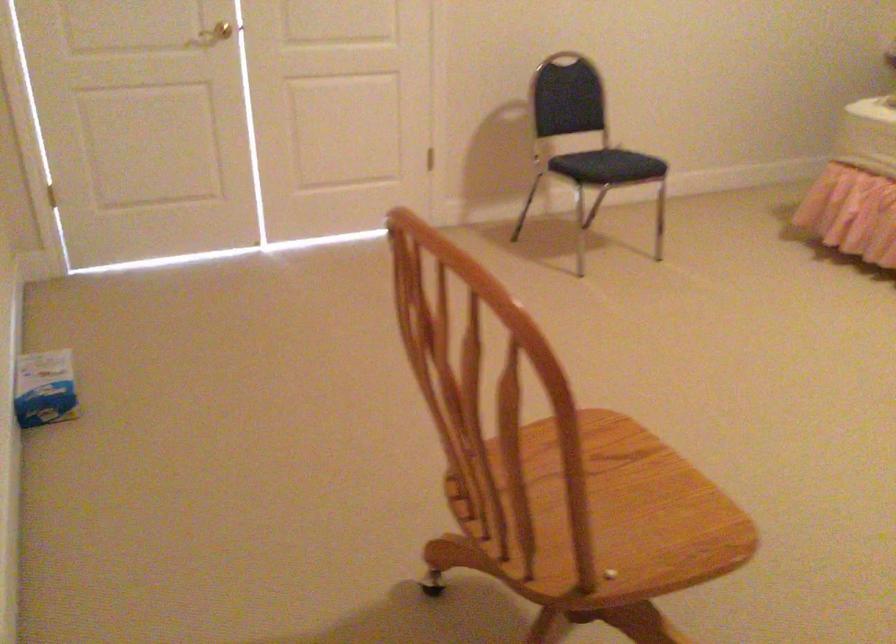
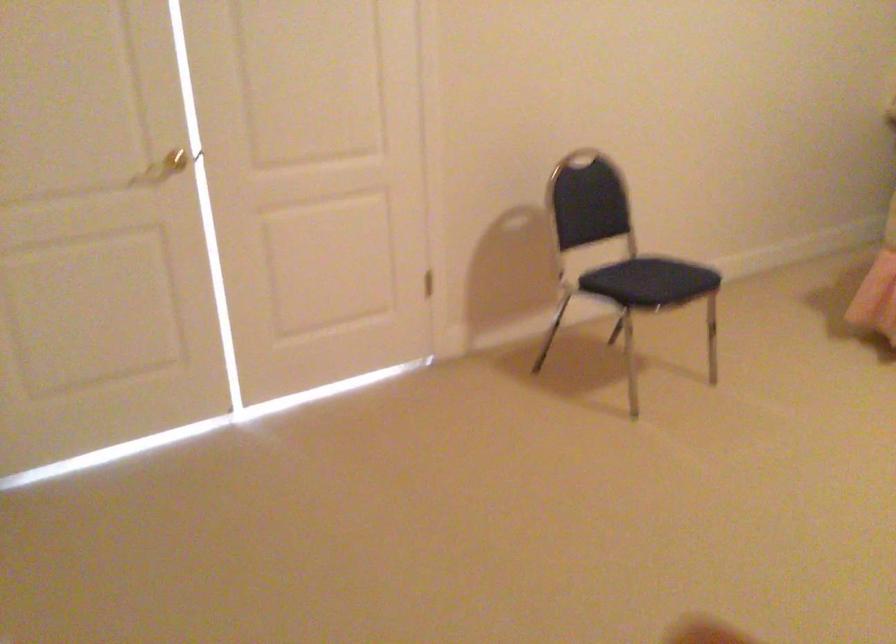
The point at (x=623, y=158) is marked in the first image. Where is the corresponding point in the second image?

(657, 276)